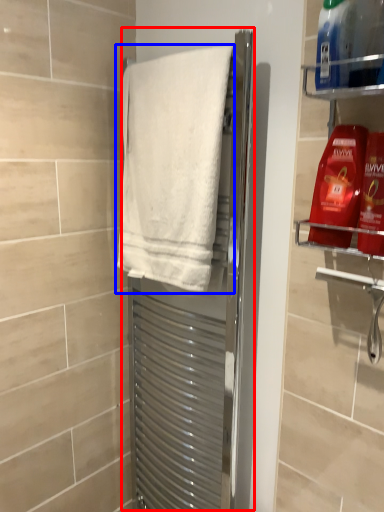
Question: Among these objects, which one is nearest to the camera, screen door (highlighted by a red box) or towel (highlighted by a blue box)?

Choices:
 (A) screen door
 (B) towel

Answer: (B)